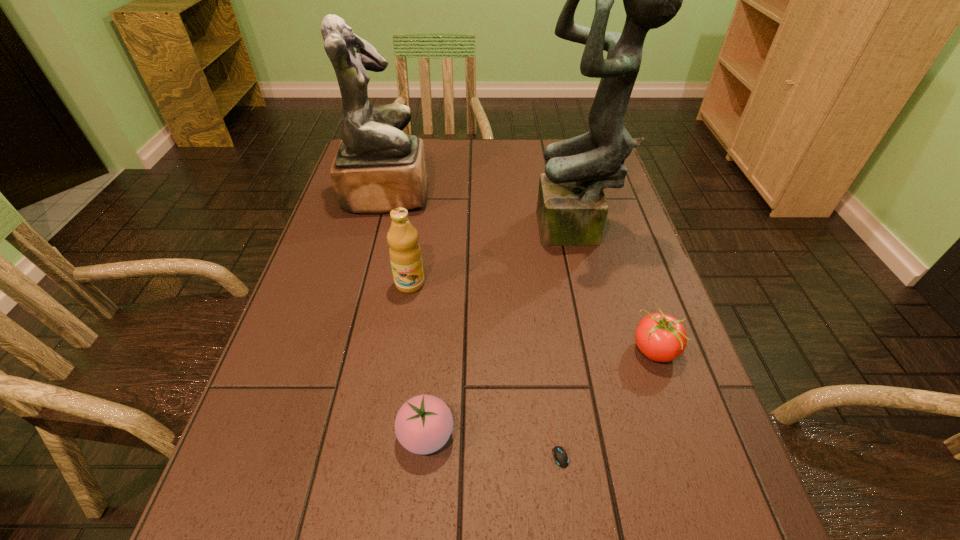
You are a GUI agent. You are given a task and a screenshot of the screen. Output one action in this format:
    pyautogui.click(x=<x>, y=<y>)
    Task: Click on the sculpture that is at the right edge
    
    Given the screenshot: What is the action you would take?
    pyautogui.click(x=572, y=209)

The height and width of the screenshot is (540, 960). Identify the location of tomato that is at the right edge. (660, 337).

You are a GUI agent. You are given a task and a screenshot of the screen. Output one action in this format:
    pyautogui.click(x=<x>, y=<y>)
    Task: Click on the object that is at the far left corner
    The width and height of the screenshot is (960, 540).
    Given the screenshot: What is the action you would take?
    pyautogui.click(x=377, y=168)

In the image, there is a desktop. Where is `free space at the far edge`? Image resolution: width=960 pixels, height=540 pixels. free space at the far edge is located at coordinates (481, 173).

Locate an element on the screen. The height and width of the screenshot is (540, 960). free space at the left edge of the desktop is located at coordinates (330, 268).

What are the coordinates of `free space at the right edge` in the screenshot? It's located at (628, 232).

Identify the location of free spot between the mouse and the right tomato. (606, 396).

Find the location of a particular element. vacant area that lies between the taller sculpture and the shortest object is located at coordinates (567, 338).

The image size is (960, 540). I want to click on blank region between the right sculpture and the shorter sculpture, so click(482, 213).

You are a GUI agent. You are given a task and a screenshot of the screen. Output one action in this format:
    pyautogui.click(x=<x>, y=<y>)
    Task: Click on the empty space between the right tomato and the shortest object
    
    Given the screenshot: What is the action you would take?
    pyautogui.click(x=606, y=396)